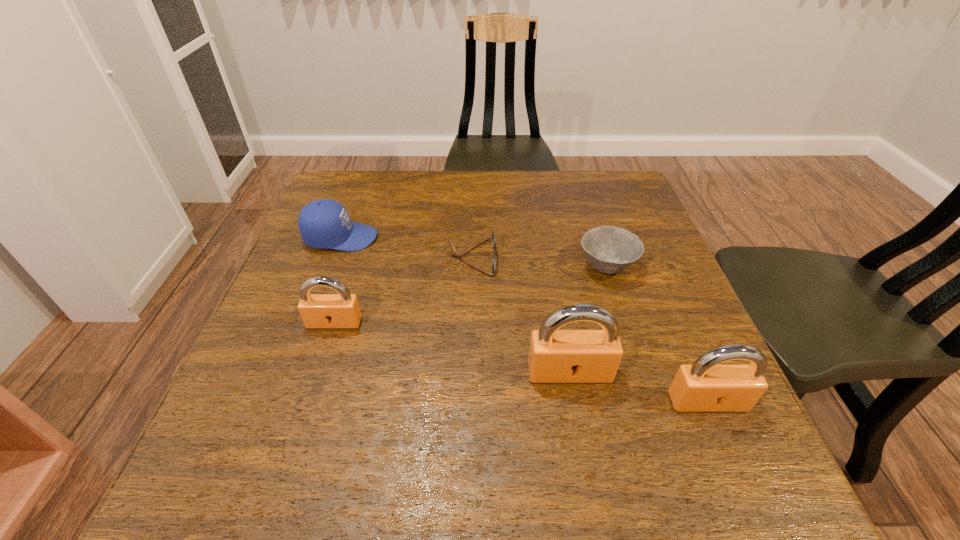
Please point a location where one more padlock can be added evenly. Please provide its 2D coordinates. Your answer should be formatted as a tuple, i.e. [(x, y)], where the tuple contains the x and y coordinates of a point satisfying the conditions above.

[(445, 346)]